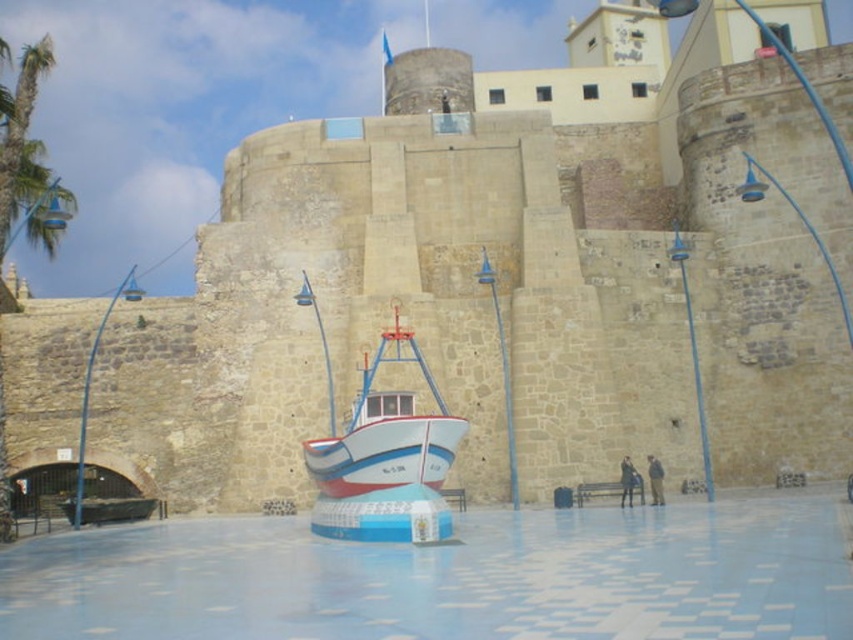
Question: Which point is closer to the camera taking this photo?

Choices:
 (A) (326, 442)
 (B) (28, 109)

Answer: (A)

Question: Which of the following is the farthest from the observer?

Choices:
 (A) (332, 452)
 (B) (0, 232)

Answer: (B)

Question: Which of the following is the closest to the observer?

Choices:
 (A) (395, 352)
 (B) (15, 145)

Answer: (B)

Question: Can you confirm if white glossy boat at center is positioned to the left of green leafy palm tree at upper left?

Choices:
 (A) no
 (B) yes

Answer: (A)

Question: Does white glossy boat at center have a greater width compared to green leafy palm tree at upper left?

Choices:
 (A) no
 (B) yes

Answer: (A)

Question: Is white glossy boat at center behind green leafy palm tree at upper left?

Choices:
 (A) no
 (B) yes

Answer: (A)